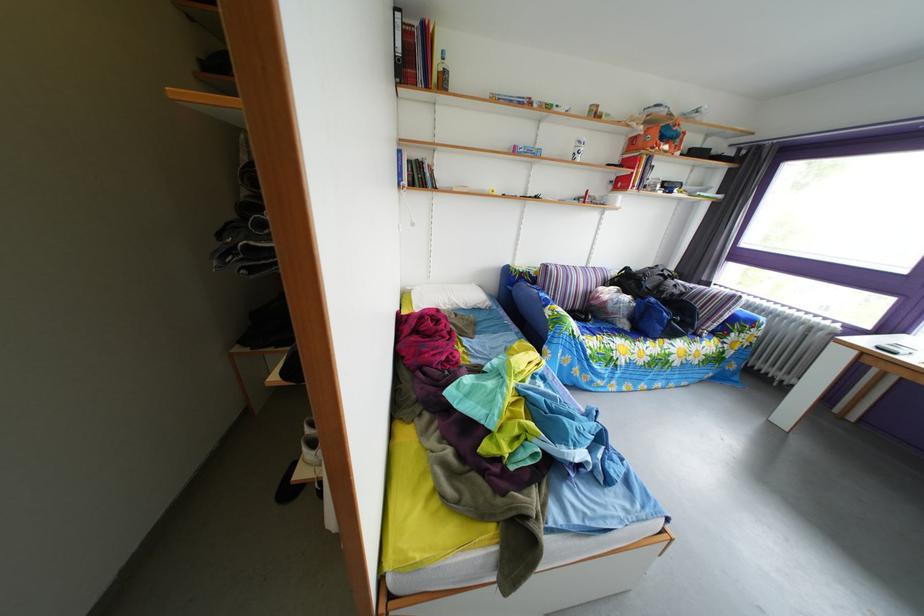
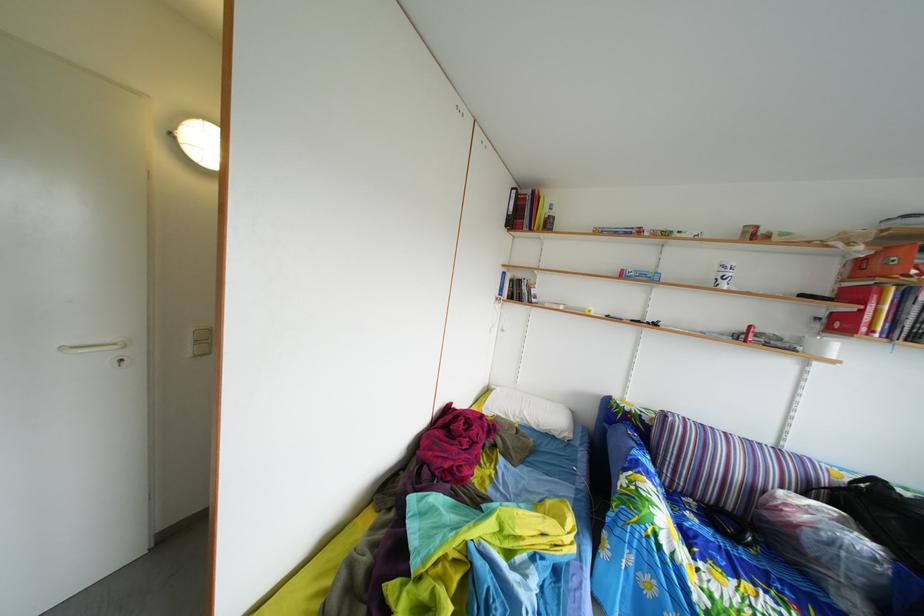
Locate, in the second image, the point that corresponds to [585,152] in the first image.

(727, 276)